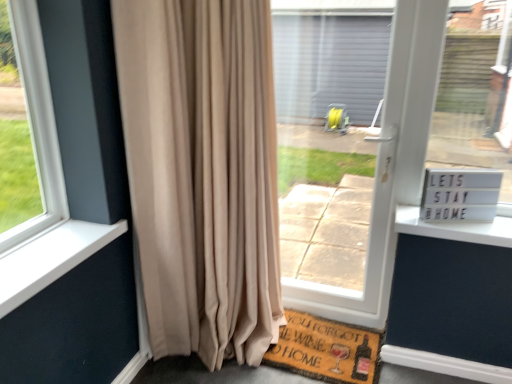
What do you see at coordinates (294, 363) in the screenshot? The width and height of the screenshot is (512, 384). I see `brown mat at lower center` at bounding box center [294, 363].

You are a GUI agent. You are given a task and a screenshot of the screen. Output one action in this format:
    pyautogui.click(x=<x>, y=<y>)
    Task: Click on the brown mat at lower center
    Image resolution: width=512 pixels, height=384 pixels.
    Given the screenshot: What is the action you would take?
    pyautogui.click(x=294, y=363)

Describe the element at coordinates (326, 350) in the screenshot. I see `brown woven mat at lower center` at that location.

Looking at this image, in order to face white plastic sign at right, should I rotate leftwards or rightwards?

You should rotate right by 25.812 degrees.

The height and width of the screenshot is (384, 512). Find the location of `brown mat at lower center`. brown mat at lower center is located at coordinates 294,363.

Locate an element on the screen. The image size is (512, 384). curtain positioned vertically above the transparent plastic screen door at center (from a real-world perspective) is located at coordinates (202, 173).

Between transparent plastic screen door at center and beige velvet curtain at left, which one is positioned behind?

transparent plastic screen door at center is further away from the camera.

Is point (328, 67) behind point (127, 20)?

Yes, it is.

From the image's perspective, would you say brown woven mat at lower center is positioned over transparent plastic screen door at center?

Actually, brown woven mat at lower center appears below transparent plastic screen door at center in the image.

From a real-world perspective, is brown woven mat at lower center physically located above or below transparent plastic screen door at center?

Clearly, from a real-world perspective, brown woven mat at lower center is below transparent plastic screen door at center.

Which is closer, (268, 359) or (382, 70)?

Clearly, point (268, 359) is closer to the camera than point (382, 70).

Is brown woven mat at lower center aimed at transparent plastic screen door at center?

No, brown woven mat at lower center is not aimed at transparent plastic screen door at center.

Locate an element on the screen. plaque to the right of brown mat at lower center is located at coordinates (460, 194).

From the image's perspective, which object appears higher, brown mat at lower center or white plastic sign at right?

From the image's view, white plastic sign at right is above.

Which is further, (289, 322) or (470, 174)?

The point (289, 322) is farther from the camera.

Based on the photo, considering the relative sizes of brown mat at lower center and white plastic sign at right in the image provided, is brown mat at lower center bigger than white plastic sign at right?

Yes.

Does brown woven mat at lower center lie behind brown mat at lower center?

Yes, brown woven mat at lower center is behind brown mat at lower center.

Is brown woven mat at lower center not close to brown mat at lower center?

They are positioned close to each other.

Which is more to the left, brown woven mat at lower center or brown mat at lower center?

From the viewer's perspective, brown woven mat at lower center appears more on the left side.

In the scene shown: Who is smaller, brown woven mat at lower center or brown mat at lower center?

brown woven mat at lower center.

How many degrees apart are the facing directions of beige velvet curtain at left and white plastic sign at right?

There is a 16.4-degree angle between the facing directions of beige velvet curtain at left and white plastic sign at right.

Does beige velvet curtain at left turn towards white plastic sign at right?

No, beige velvet curtain at left is not turned towards white plastic sign at right.

Locate an element on the screen. The width and height of the screenshot is (512, 384). curtain that appears above the white plastic sign at right (from the image's perspective) is located at coordinates pos(202,173).

How much distance is there between beige velvet curtain at left and white plastic sign at right?

beige velvet curtain at left is 36.01 inches away from white plastic sign at right.

Is brown mat at lower center positioned far away from beige velvet curtain at left?

No, there isn't a large distance between brown mat at lower center and beige velvet curtain at left.

Considering the sizes of objects brown mat at lower center and beige velvet curtain at left in the image provided, who is shorter, brown mat at lower center or beige velvet curtain at left?

With less height is brown mat at lower center.

From the image's perspective, which one is positioned higher, brown mat at lower center or beige velvet curtain at left?

From the image's view, beige velvet curtain at left is above.

Are beige velvet curtain at left and brown woven mat at lower center located far from each other?

No, beige velvet curtain at left is not far from brown woven mat at lower center.

Locate an element on the screen. This screenshot has width=512, height=384. doormat on the right of beige velvet curtain at left is located at coordinates click(326, 350).

In the image, is beige velvet curtain at left positioned in front of or behind brown woven mat at lower center?

beige velvet curtain at left is positioned closer to the viewer than brown woven mat at lower center.

Which point is more forward, (x=240, y=214) or (x=312, y=371)?

The point (x=240, y=214) is in front.

At what (x,y) coordinates should I click in order to perform the action: click on curtain lying on the left of transparent plastic screen door at center. Please return your answer as a coordinate pair (x, y). This screenshot has width=512, height=384. Looking at the image, I should click on (202, 173).

This screenshot has width=512, height=384. I want to click on doormat below the transparent plastic screen door at center (from a real-world perspective), so click(326, 350).

Looking at the image, which one is located further to brown woven mat at lower center, white plastic sign at right or beige velvet curtain at left?

white plastic sign at right is further to brown woven mat at lower center.

Estimate the real-world distances between objects in this image. Which object is closer to brown woven mat at lower center, brown mat at lower center or white plastic sign at right?

brown mat at lower center is positioned closer to the anchor brown woven mat at lower center.

Estimate the real-world distances between objects in this image. Which object is closer to beige velvet curtain at left, transparent plastic screen door at center or white plastic sign at right?

white plastic sign at right lies closer to beige velvet curtain at left than the other object.

When comparing their distances from brown woven mat at lower center, does transparent plastic screen door at center or beige velvet curtain at left seem closer?

transparent plastic screen door at center lies closer to brown woven mat at lower center than the other object.

When comparing their distances from transparent plastic screen door at center, does brown woven mat at lower center or beige velvet curtain at left seem closer?

brown woven mat at lower center.

From the picture: Which object lies further to the anchor point beige velvet curtain at left, white plastic sign at right or brown mat at lower center?

The object further to beige velvet curtain at left is white plastic sign at right.

Which object lies further to the anchor point transparent plastic screen door at center, white plastic sign at right or brown mat at lower center?

white plastic sign at right is positioned further to the anchor transparent plastic screen door at center.

From the picture: From the image, which object appears to be nearer to white plastic sign at right, brown woven mat at lower center or transparent plastic screen door at center?

transparent plastic screen door at center lies closer to white plastic sign at right than the other object.

This screenshot has width=512, height=384. I want to click on doormat between beige velvet curtain at left and brown mat at lower center in the vertical direction, so coord(326,350).

In order to click on plaque between beige velvet curtain at left and brown mat at lower center from top to bottom in this screenshot , I will do `click(460, 194)`.

The image size is (512, 384). I want to click on screen door between beige velvet curtain at left and white plastic sign at right from left to right, so click(x=340, y=152).

Find the location of `doormat situated between beige velvet curtain at left and white plastic sign at right from left to right`. doormat situated between beige velvet curtain at left and white plastic sign at right from left to right is located at coordinates (326, 350).